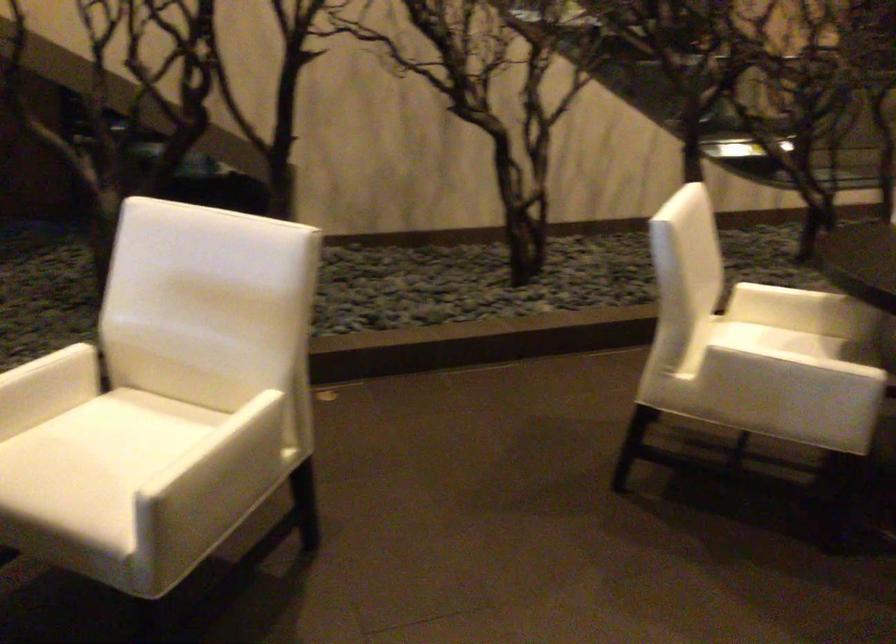
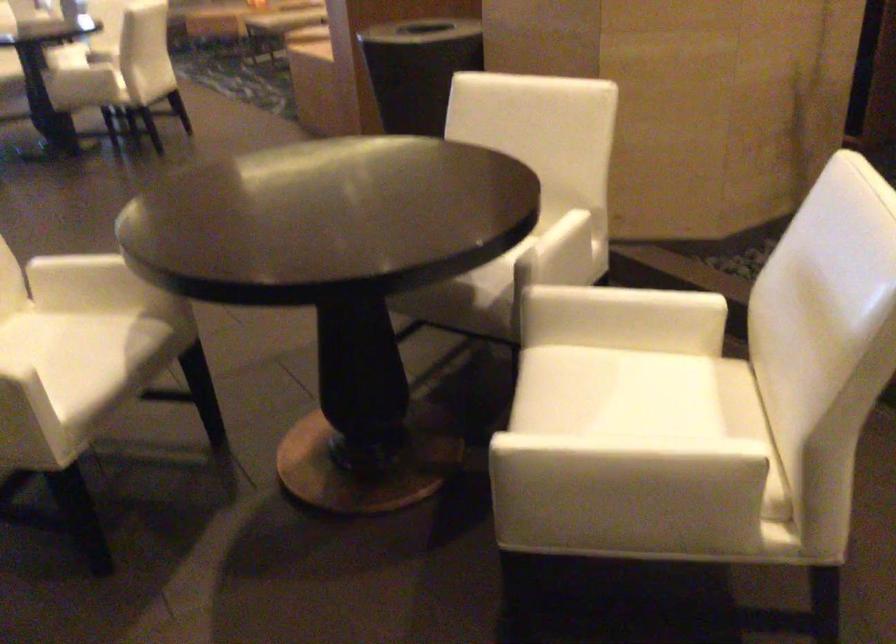
Locate, in the second image, the point that corresponds to (x=221, y=458) in the first image.

(607, 462)